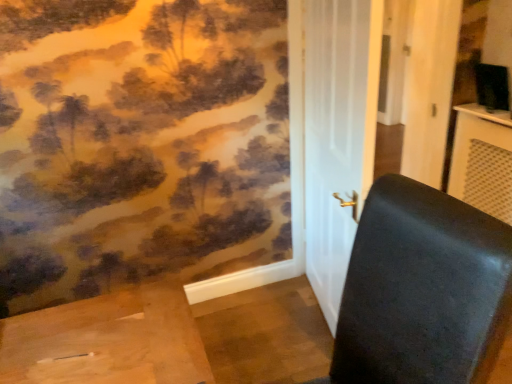
Question: Is point coord(488,132) positioned closer to the camera than point coord(317,268)?

Choices:
 (A) closer
 (B) farther

Answer: (B)

Question: From the image's perspective, is matte black table at right positioned above or below white glossy door at center?

Choices:
 (A) above
 (B) below

Answer: (B)

Question: Estimate the real-world distances between objects in this image. Which object is farther from the matte black table at right?

Choices:
 (A) black leather chair at right
 (B) white glossy door at center

Answer: (A)

Question: Based on their relative distances, which object is farther from the white glossy door at center?

Choices:
 (A) black leather chair at right
 (B) matte black table at right

Answer: (B)